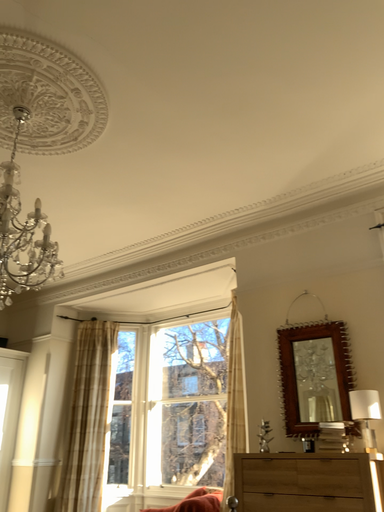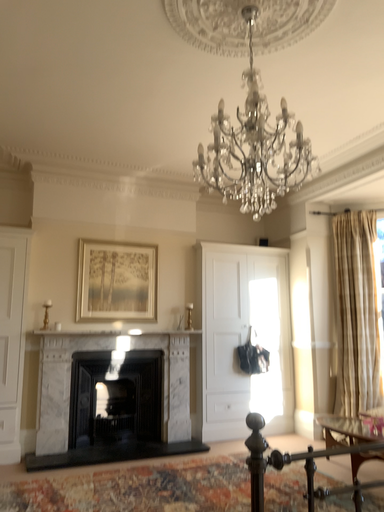
Question: How did the camera likely rotate when shooting the video?

Choices:
 (A) rotated upward
 (B) rotated downward

Answer: (B)